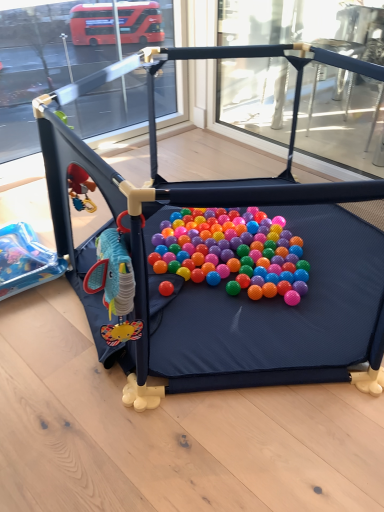
Question: Should I look upward or downward to see rubberized plastic ball pit at center, which ranks as the 1th toy in right-to-left order?

Choices:
 (A) up
 (B) down

Answer: (A)

Question: Is plastic blue toy at left, placed as the 2th toy when sorted from right to left, shorter than rubberized plastic ball pit at center, arranged as the 2th toy when viewed from the left?

Choices:
 (A) yes
 (B) no

Answer: (A)

Question: Does plastic blue toy at left, placed as the 2th toy when sorted from right to left, appear on the left side of rubberized plastic ball pit at center, arranged as the 2th toy when viewed from the left?

Choices:
 (A) yes
 (B) no

Answer: (A)

Question: Does plastic blue toy at left, placed as the 2th toy when sorted from right to left, lie in front of rubberized plastic ball pit at center, which ranks as the 1th toy in right-to-left order?

Choices:
 (A) yes
 (B) no

Answer: (B)

Question: Does plastic blue toy at left, which appears as the first toy when viewed from the left, contain rubberized plastic ball pit at center, arranged as the 2th toy when viewed from the left?

Choices:
 (A) no
 (B) yes

Answer: (A)

Question: Is plastic blue toy at left, placed as the 2th toy when sorted from right to left, at the right side of rubberized plastic ball pit at center, which ranks as the 1th toy in right-to-left order?

Choices:
 (A) yes
 (B) no

Answer: (B)

Question: From a real-world perspective, is plastic blue toy at left, which appears as the first toy when viewed from the left, under rubberized plastic ball pit at center, arranged as the 2th toy when viewed from the left?

Choices:
 (A) yes
 (B) no

Answer: (A)

Question: Is rubberized plastic ball pit at center, arranged as the 2th toy when viewed from the left, at the right side of plastic blue toy at left, placed as the 2th toy when sorted from right to left?

Choices:
 (A) yes
 (B) no

Answer: (A)

Question: Considering the relative sizes of rubberized plastic ball pit at center, which ranks as the 1th toy in right-to-left order, and plastic blue toy at left, which appears as the first toy when viewed from the left, in the image provided, is rubberized plastic ball pit at center, which ranks as the 1th toy in right-to-left order, taller than plastic blue toy at left, which appears as the first toy when viewed from the left,?

Choices:
 (A) no
 (B) yes

Answer: (B)

Question: Could you tell me if rubberized plastic ball pit at center, arranged as the 2th toy when viewed from the left, is turned towards plastic blue toy at left, placed as the 2th toy when sorted from right to left?

Choices:
 (A) yes
 (B) no

Answer: (B)

Question: Can you confirm if rubberized plastic ball pit at center, arranged as the 2th toy when viewed from the left, is bigger than plastic blue toy at left, placed as the 2th toy when sorted from right to left?

Choices:
 (A) no
 (B) yes

Answer: (B)

Question: Is rubberized plastic ball pit at center, arranged as the 2th toy when viewed from the left, not within plastic blue toy at left, placed as the 2th toy when sorted from right to left?

Choices:
 (A) yes
 (B) no

Answer: (A)

Question: Is there a large distance between rubberized plastic ball pit at center, arranged as the 2th toy when viewed from the left, and plastic blue toy at left, placed as the 2th toy when sorted from right to left?

Choices:
 (A) yes
 (B) no

Answer: (B)

Question: Is plastic blue toy at left, which appears as the first toy when viewed from the left, to the left or to the right of rubberized plastic ball pit at center, which ranks as the 1th toy in right-to-left order, in the image?

Choices:
 (A) left
 (B) right

Answer: (A)